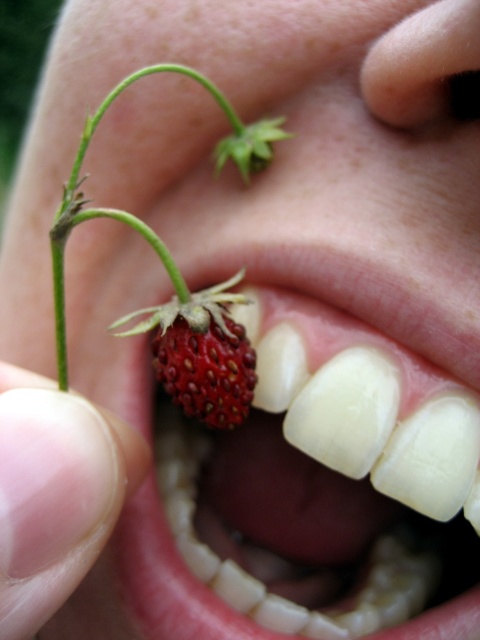
Can you confirm if ripe red strawberry at mouth center is positioned above smooth skin at mouth?

Incorrect, ripe red strawberry at mouth center is not positioned above smooth skin at mouth.

Is ripe red strawberry at mouth center bigger than smooth skin at mouth?

Correct, ripe red strawberry at mouth center is larger in size than smooth skin at mouth.

Does point (468, 460) lie in front of point (91, 452)?

No, (468, 460) is further to viewer.

The image size is (480, 640). I want to click on ripe red strawberry at mouth center, so click(316, 470).

Locate an element on the screen. This screenshot has height=640, width=480. smooth skin at mouth is located at coordinates (56, 492).

Is smooth skin at mouth wider than ripe red strawberry at mouth?

Yes, smooth skin at mouth is wider than ripe red strawberry at mouth.

Which is behind, point (107, 540) or point (208, 412)?

The point (208, 412) is behind.

This screenshot has width=480, height=640. I want to click on smooth skin at mouth, so click(56, 492).

From the picture: Does ripe red strawberry at mouth center appear under ripe red strawberry at mouth?

Indeed, ripe red strawberry at mouth center is positioned under ripe red strawberry at mouth.

What do you see at coordinates (316, 470) in the screenshot? This screenshot has height=640, width=480. I see `ripe red strawberry at mouth center` at bounding box center [316, 470].

The image size is (480, 640). In order to click on ripe red strawberry at mouth center in this screenshot , I will do `click(316, 470)`.